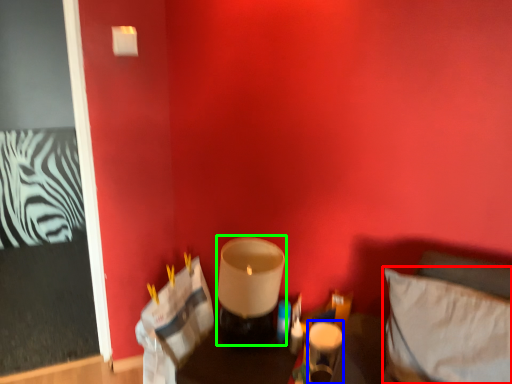
Question: Which object is the farthest from pillow (highlighted by a red box)? Choose among these: candle holder (highlighted by a blue box) or candle holder (highlighted by a green box).

Choices:
 (A) candle holder
 (B) candle holder

Answer: (B)